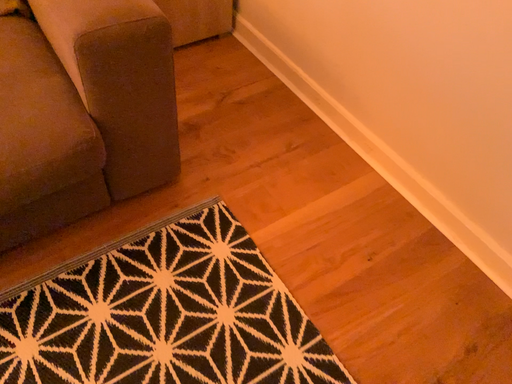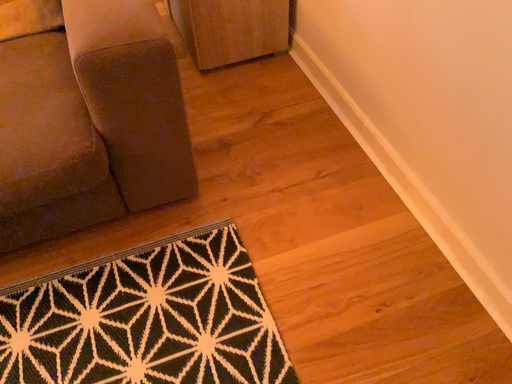
Question: How did the camera likely rotate when shooting the video?

Choices:
 (A) rotated left
 (B) rotated right

Answer: (A)